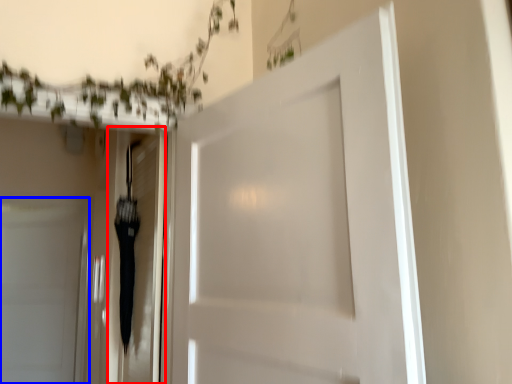
Question: Which of the following is the closest to the observer, elevator (highlighted by a red box) or door (highlighted by a blue box)?

Choices:
 (A) elevator
 (B) door

Answer: (A)